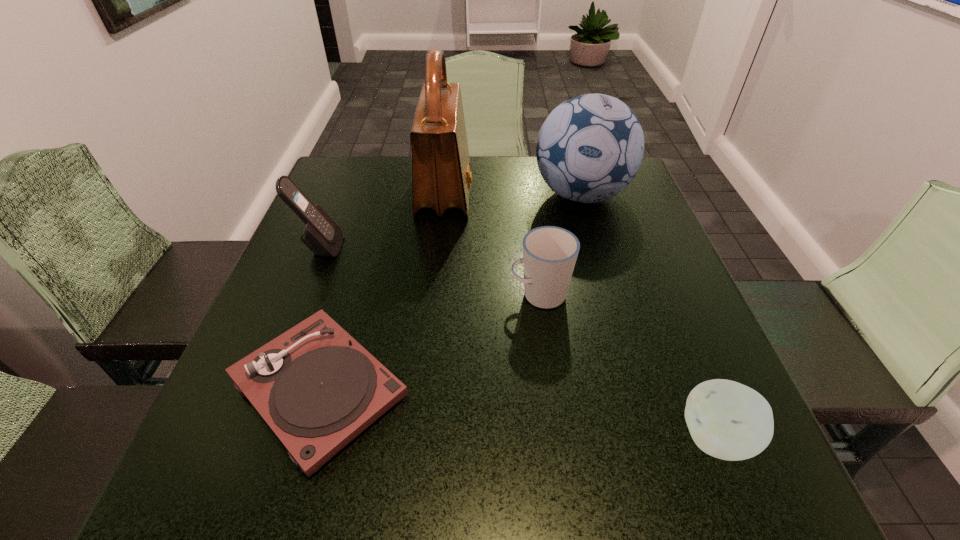
Identify the location of the tallest object. The width and height of the screenshot is (960, 540). (441, 178).

At what (x,y) coordinates should I click in order to perform the action: click on the second tallest object. Please return your answer as a coordinate pair (x, y). The height and width of the screenshot is (540, 960). Looking at the image, I should click on (590, 147).

Locate an element on the screen. This screenshot has height=540, width=960. the third tallest object is located at coordinates (321, 235).

Where is `the fourth nearest object`? The width and height of the screenshot is (960, 540). the fourth nearest object is located at coordinates (x=321, y=235).

What are the coordinates of `cup` in the screenshot? It's located at (549, 253).

Image resolution: width=960 pixels, height=540 pixels. I want to click on the fourth tallest object, so click(x=549, y=253).

What are the coordinates of `apple` in the screenshot? It's located at (727, 420).

You are a GUI agent. You are given a task and a screenshot of the screen. Output one action in this format:
    pyautogui.click(x=<x>, y=<y>)
    Task: Click on the shortest object
    
    Given the screenshot: What is the action you would take?
    pyautogui.click(x=317, y=388)

Where is `vacant space located on the front flap of the tallest object`? vacant space located on the front flap of the tallest object is located at coordinates pyautogui.click(x=533, y=193).

Where is `vacant space located 0.390m on the side with brand of the soccer ball`? vacant space located 0.390m on the side with brand of the soccer ball is located at coordinates (628, 357).